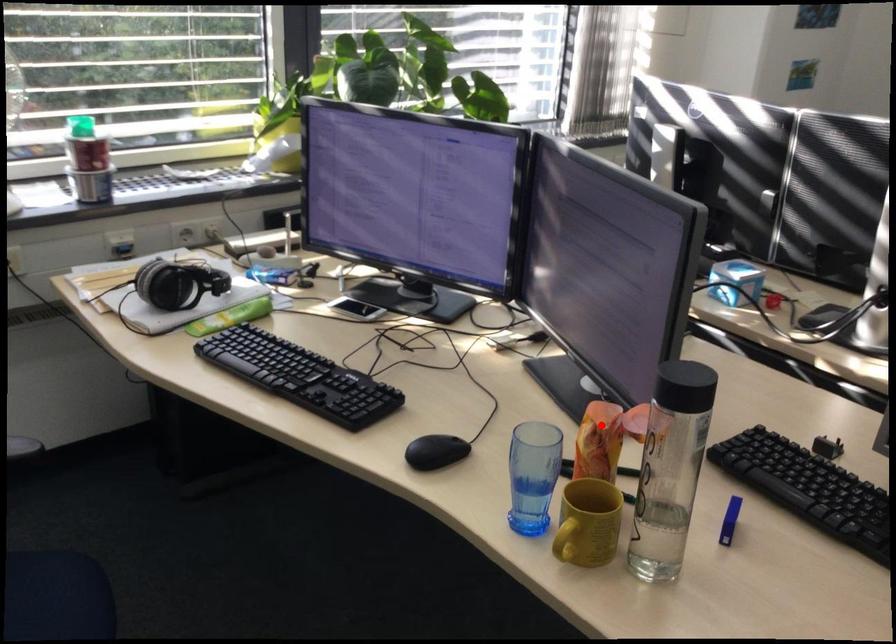
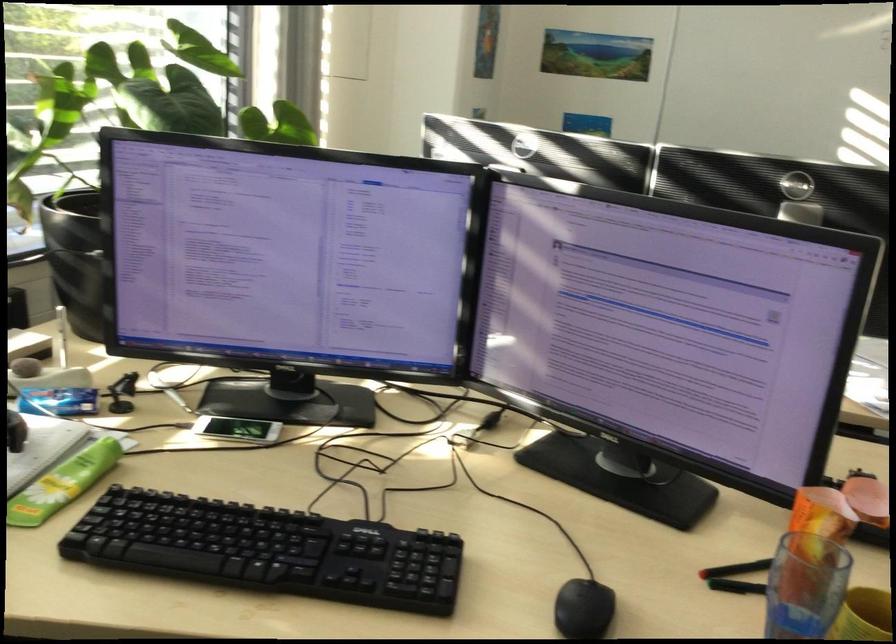
Question: I am providing you with two images of the same scene from different viewpoints. Given a red point in image1, look at the same physical point in image2. Is it:

Choices:
 (A) Closer to the viewpoint
 (B) Farther from the viewpoint

Answer: (A)